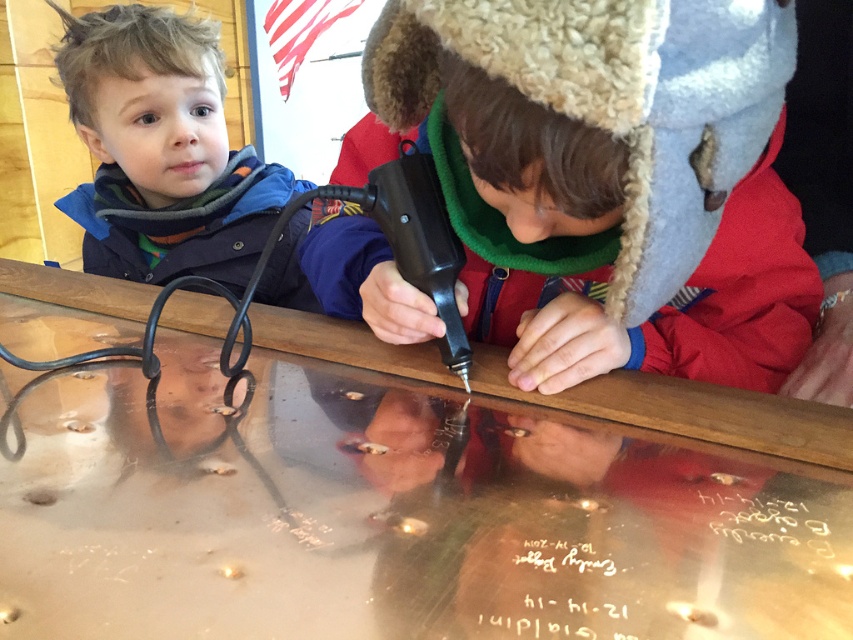
Who is positioned more to the right, metallic polished table at center or blue fleece jacket at upper left?

Positioned to the right is metallic polished table at center.

Does metallic polished table at center come in front of blue fleece jacket at upper left?

Yes, metallic polished table at center is closer to the viewer.

I want to click on metallic polished table at center, so click(392, 515).

You are a GUI agent. You are given a task and a screenshot of the screen. Output one action in this format:
    pyautogui.click(x=<x>, y=<y>)
    Task: Click on the metallic polished table at center
    The width and height of the screenshot is (853, 640).
    Given the screenshot: What is the action you would take?
    (x=392, y=515)

In the scene shown: Can you confirm if matte black glue gun at center is bigger than blue fleece jacket at upper left?

Yes.

Does matte black glue gun at center have a smaller size compared to blue fleece jacket at upper left?

Incorrect, matte black glue gun at center is not smaller in size than blue fleece jacket at upper left.

This screenshot has width=853, height=640. What do you see at coordinates (605, 177) in the screenshot?
I see `matte black glue gun at center` at bounding box center [605, 177].

Where is `matte black glue gun at center`? Image resolution: width=853 pixels, height=640 pixels. matte black glue gun at center is located at coordinates (605, 177).

Which is below, metallic polished table at center or matte black glue gun at center?

metallic polished table at center

Who is positioned more to the right, metallic polished table at center or matte black glue gun at center?

matte black glue gun at center

What do you see at coordinates (392, 515) in the screenshot? This screenshot has height=640, width=853. I see `metallic polished table at center` at bounding box center [392, 515].

Locate an element on the screen. The width and height of the screenshot is (853, 640). metallic polished table at center is located at coordinates (392, 515).